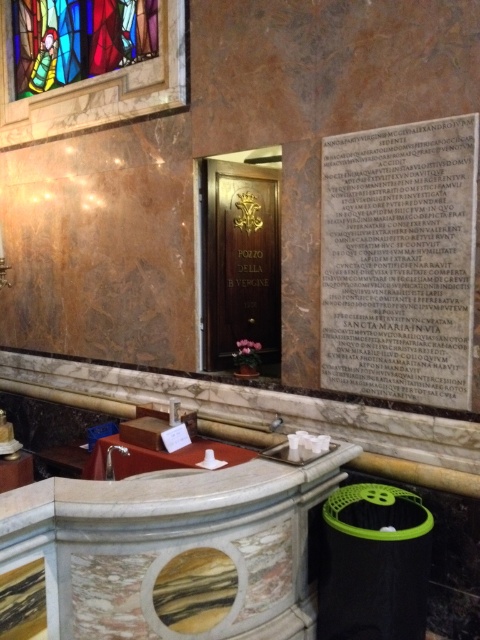
Question: Which of the following is the farthest from the observer?

Choices:
 (A) (470, 173)
 (B) (135, 28)

Answer: (B)

Question: Does black stone plaque at center appear under stained glass window at upper left?

Choices:
 (A) yes
 (B) no

Answer: (A)

Question: Can you confirm if black stone plaque at center is smaller than stained glass window at upper left?

Choices:
 (A) no
 (B) yes

Answer: (B)

Question: Is black stone plaque at center wider than stained glass window at upper left?

Choices:
 (A) yes
 (B) no

Answer: (B)